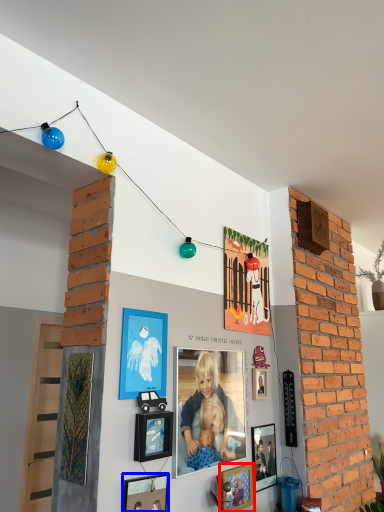
Question: Which object is closer to the camera taking this photo, picture frame (highlighted by a red box) or picture frame (highlighted by a blue box)?

Choices:
 (A) picture frame
 (B) picture frame

Answer: (B)